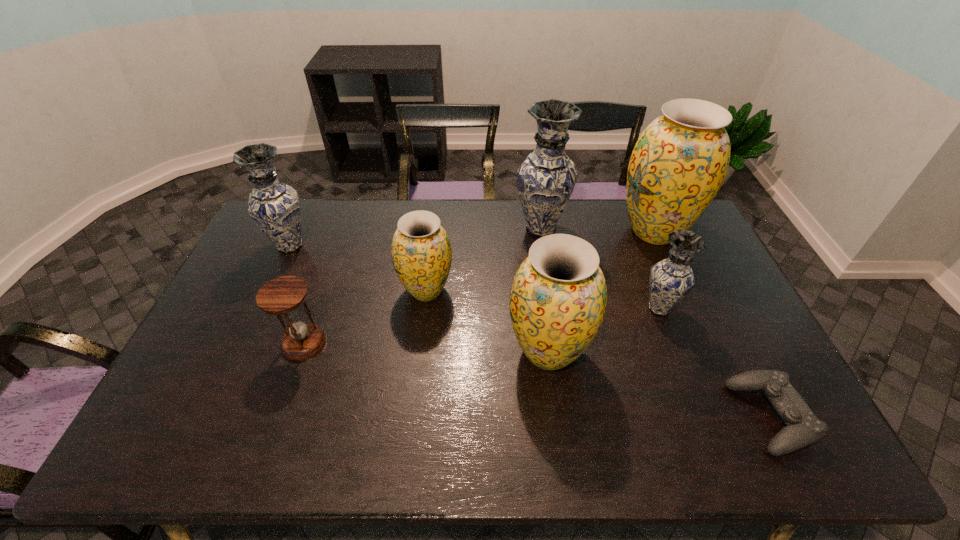
You are a GUI agent. You are given a task and a screenshot of the screen. Output one action in this format:
    pyautogui.click(x=<x>, y=<y>)
    Task: Click on the object that stands as the closest to the rightmost blue vase
    This screenshot has height=540, width=960.
    Given the screenshot: What is the action you would take?
    pyautogui.click(x=680, y=160)

This screenshot has height=540, width=960. I want to click on object that ranks as the second closest to the second blue vase from left to right, so click(421, 253).

Locate which vase ranks fourth in proximity to the smallest yellow vase. Please provide its 2D coordinates. Your answer should be formatted as a tuple, i.e. [(x, y)], where the tuple contains the x and y coordinates of a point satisfying the conditions above.

[(671, 279)]

Identify the location of vase that is the second closest to the gray control. (558, 298).

Identify which blue vase is the second closest to the rightmost yellow vase. Please provide its 2D coordinates. Your answer should be formatted as a tuple, i.e. [(x, y)], where the tuple contains the x and y coordinates of a point satisfying the conditions above.

[(671, 279)]

Identify the location of blue vase that can be found as the closest to the farthest yellow vase. This screenshot has height=540, width=960. (545, 180).

Identify which yellow vase is the second closest to the biggest yellow vase. Please provide its 2D coordinates. Your answer should be formatted as a tuple, i.e. [(x, y)], where the tuple contains the x and y coordinates of a point satisfying the conditions above.

[(421, 253)]

At what (x,y) coordinates should I click in order to perform the action: click on the closest yellow vase relative to the rightmost yellow vase. Please return your answer as a coordinate pair (x, y). Looking at the image, I should click on (558, 298).

Find the location of `vacant space that satisfies the following two spatial constraints: 1. on the front side of the shortest object; 2. on the left side of the seventh object from right to left`. vacant space that satisfies the following two spatial constraints: 1. on the front side of the shortest object; 2. on the left side of the seventh object from right to left is located at coordinates (278, 417).

You are a GUI agent. You are given a task and a screenshot of the screen. Output one action in this format:
    pyautogui.click(x=<x>, y=<y>)
    Task: Click on the free space that satisfies the following two spatial constraints: 1. on the front side of the biggest blue vase; 2. on the left side of the rightmost yellow vase
    The width and height of the screenshot is (960, 540).
    Given the screenshot: What is the action you would take?
    pyautogui.click(x=541, y=231)